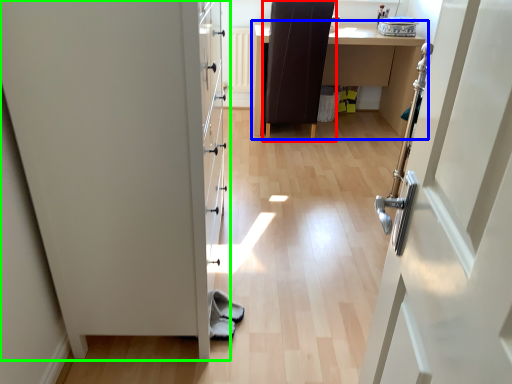
Question: Which object is the farthest from chair (highlighted by a red box)? Choose among these: table (highlighted by a blue box) or door (highlighted by a green box).

Choices:
 (A) table
 (B) door

Answer: (B)